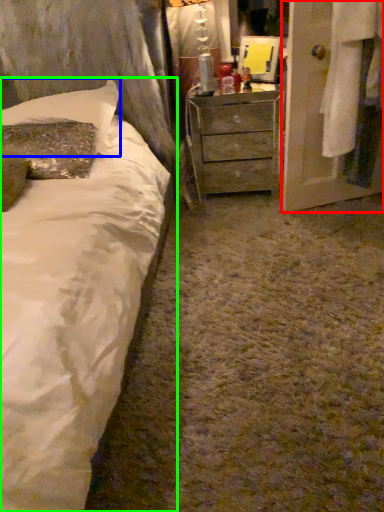
Question: Estimate the real-world distances between objects in this image. Which object is farther from armoire (highlighted by a red box), pillow (highlighted by a blue box) or bed (highlighted by a green box)?

Choices:
 (A) pillow
 (B) bed

Answer: (B)